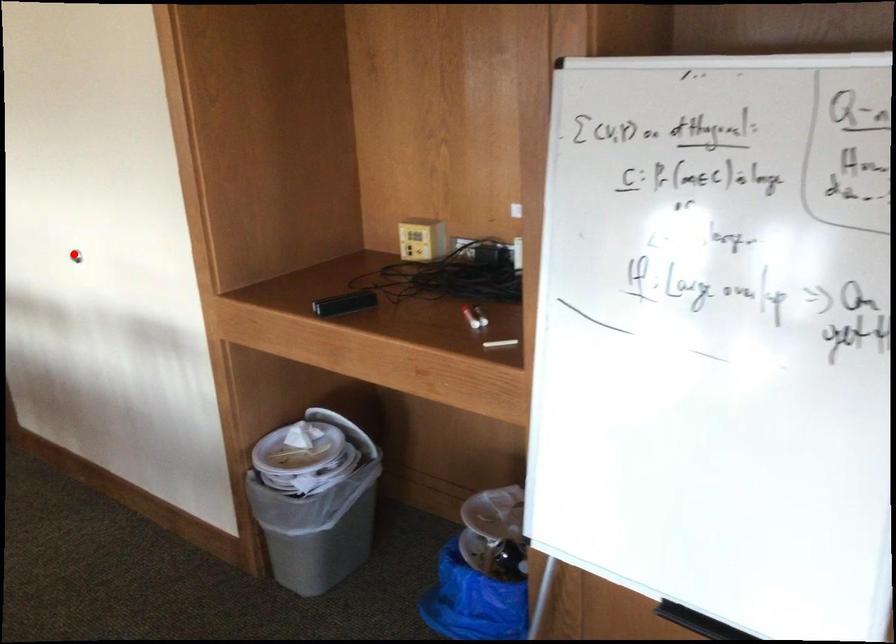
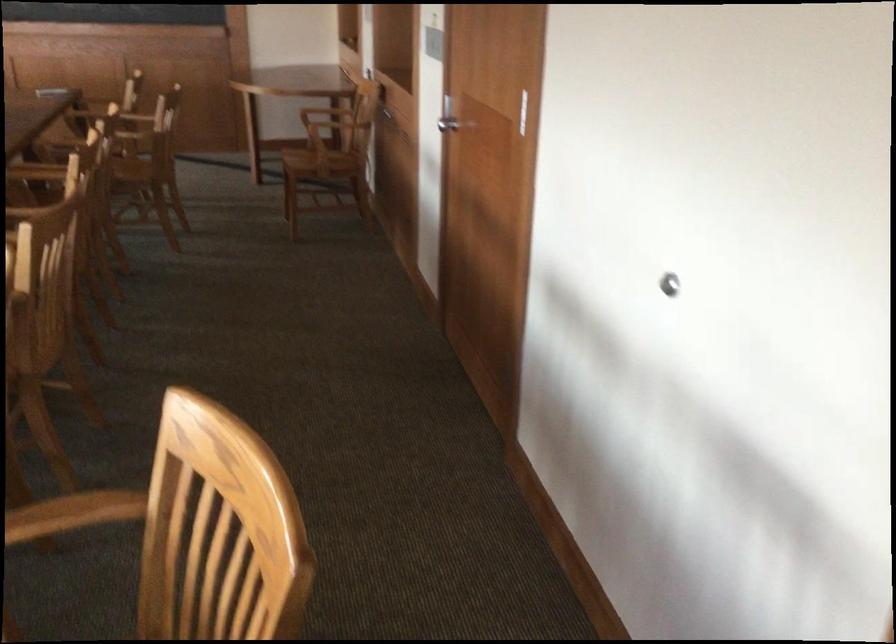
Question: I am providing you with two images of the same scene from different viewpoints. Image1 has a red point marked. In image2, the corresponding 3D location appears at what relative position? Reply with the corresponding letter.

Choices:
 (A) Closer
 (B) Farther

Answer: (A)